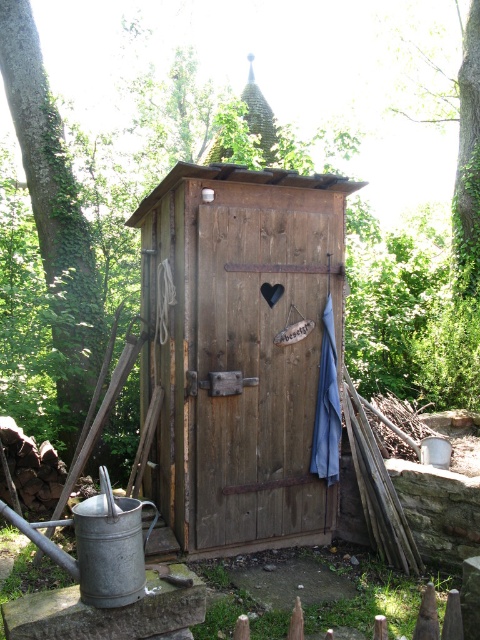
Who is lower down, wooden hut at center or green leafy tree at left?

wooden hut at center is lower down.

Does wooden hut at center appear under green leafy tree at left?

Yes.

This screenshot has height=640, width=480. I want to click on wooden hut at center, so click(239, 348).